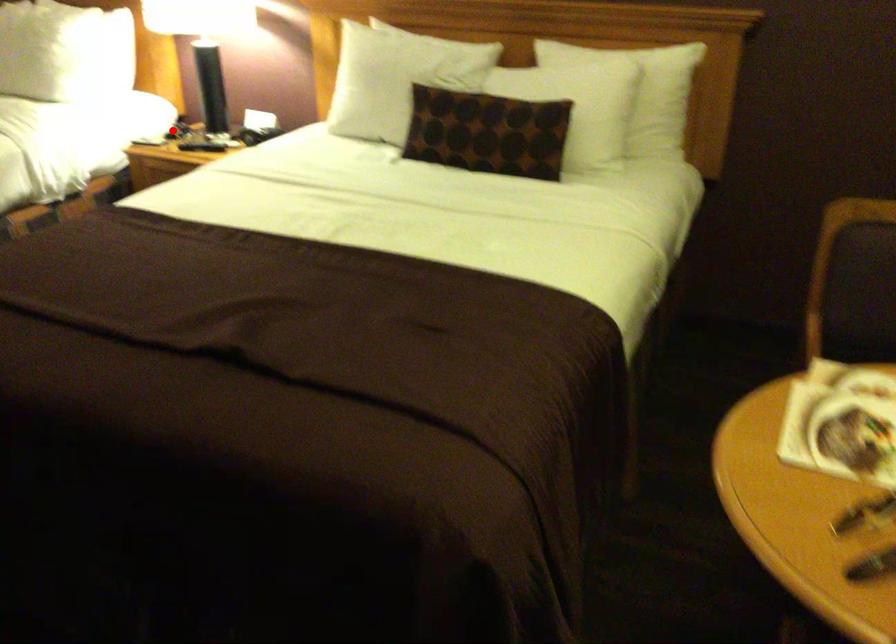
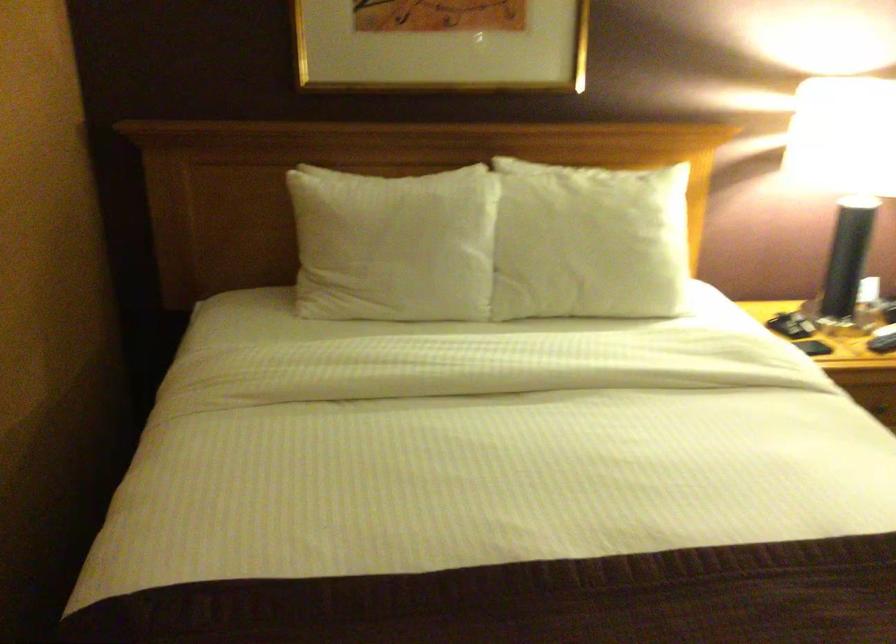
The point at the highlighted location is marked in the first image. Where is the corresponding point in the second image?

(782, 325)